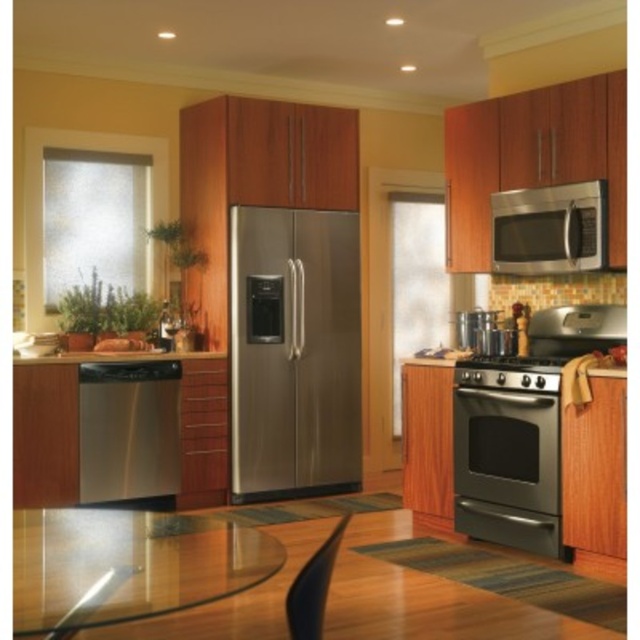
Question: Estimate the real-world distances between objects in this image. Which object is closer to the satin black oven at lower right?

Choices:
 (A) stainless steel microwave at upper right
 (B) transparent glass table at lower center
 (C) stainless steel dishwasher at lower left
 (D) satin stainless steel dishwasher at lower left

Answer: (A)

Question: Which point is farther from the camera taking this photo?

Choices:
 (A) (353, 284)
 (B) (54, 564)
 (C) (164, 353)

Answer: (A)

Question: Is satin black oven at lower right positioned behind stainless steel microwave at upper right?

Choices:
 (A) yes
 (B) no

Answer: (B)

Question: Which of the following is the closest to the observer?

Choices:
 (A) stainless steel refrigerator at center
 (B) satin black oven at lower right

Answer: (B)

Question: Can you confirm if stainless steel refrigerator at center is bigger than satin stainless steel dishwasher at lower left?

Choices:
 (A) yes
 (B) no

Answer: (A)

Question: Does stainless steel dishwasher at lower left have a lesser width compared to satin stainless steel dishwasher at lower left?

Choices:
 (A) yes
 (B) no

Answer: (A)